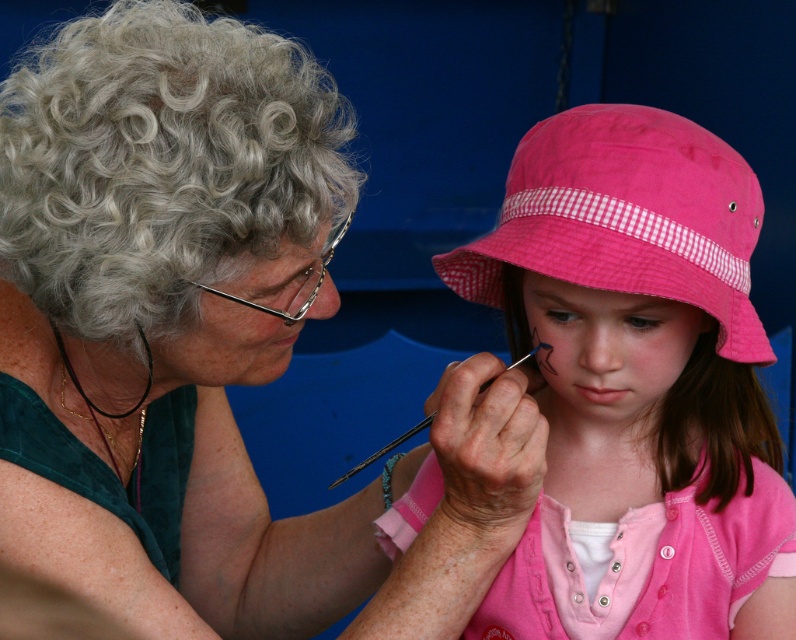
You are a photographer standing 30 inches away from the matte green blouse at center. Can you take a clear photo of it without moving closer?

The matte green blouse at center is 32.74 inches away from the viewer. Since you are already 30 inches away, you need to move 2.74 inches closer to capture a clear photo.

You are a photographer trying to capture the exact point where the paintbrush touches the girl. The point is located at coordinates point (207, 342). According to the scene, where exactly is this point located?

The point (207, 342) is on the matte green blouse at center.